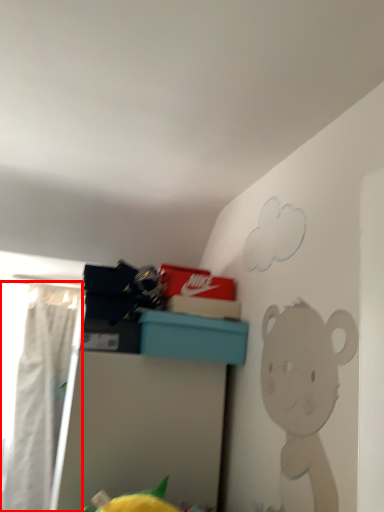
Question: From the image's perspective, considering the relative positions of curtain (annotated by the red box) and furniture in the image provided, where is curtain (annotated by the red box) located with respect to the staircase?

Choices:
 (A) above
 (B) below

Answer: (A)